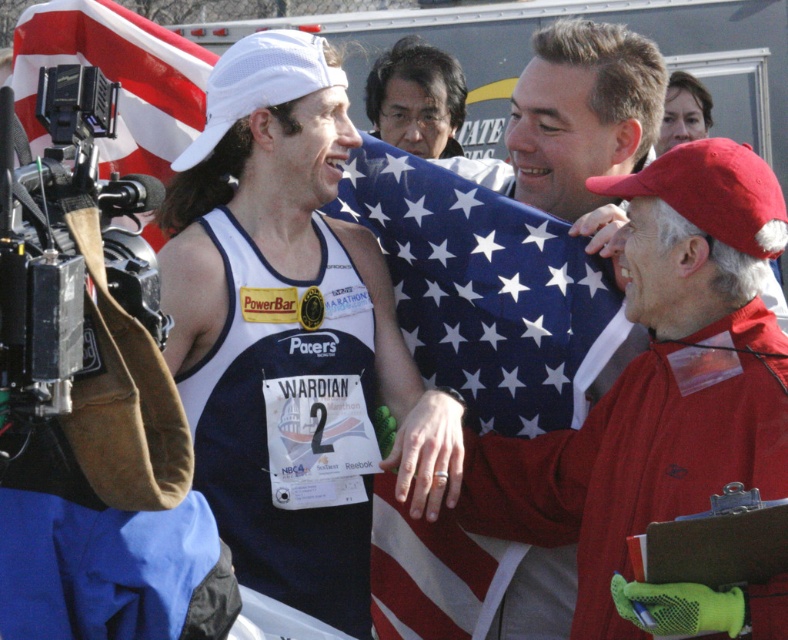
Question: Does blue fabric flag at center have a larger size compared to red-white striped flag at left?

Choices:
 (A) no
 (B) yes

Answer: (B)

Question: From the image, what is the correct spatial relationship of blue fabric flag at center in relation to red-white striped flag at left?

Choices:
 (A) below
 (B) above

Answer: (A)

Question: Is blue fabric flag at center to the right of red-white striped flag at left from the viewer's perspective?

Choices:
 (A) no
 (B) yes

Answer: (B)

Question: Which point is farther to the camera?

Choices:
 (A) (62, 16)
 (B) (642, 346)

Answer: (A)